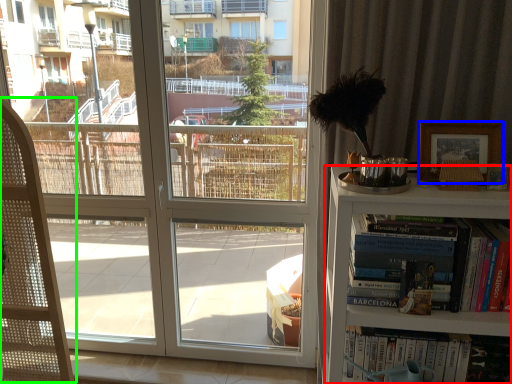
Question: Considering the real-world distances, which object is closest to bookcase (highlighted by a red box)? picture frame (highlighted by a blue box) or folding chair (highlighted by a green box).

Choices:
 (A) picture frame
 (B) folding chair

Answer: (A)